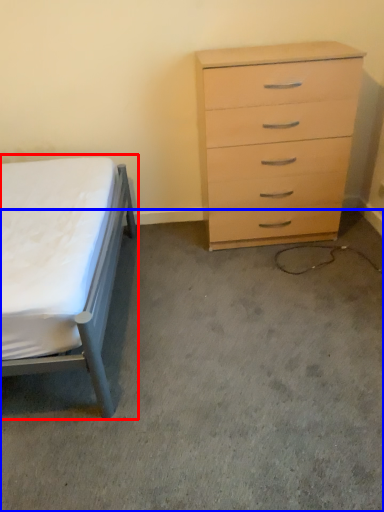
Question: Which object appears farthest to the camera in this image, bed (highlighted by a red box) or concrete (highlighted by a blue box)?

Choices:
 (A) bed
 (B) concrete

Answer: (B)